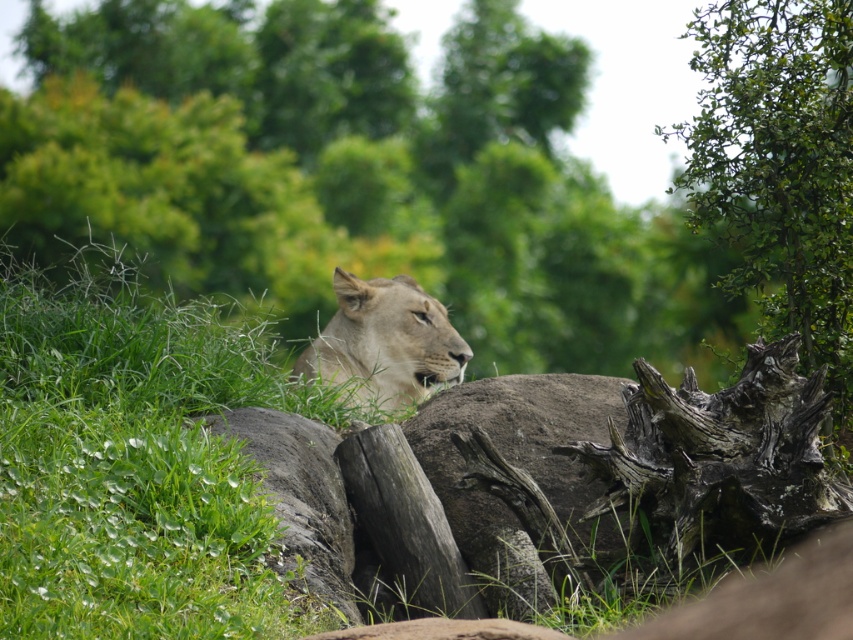
What is the location of the green leafy tree at right in the image?

The green leafy tree at right is located at point (780, 170).

You are a photographer trying to capture the light brown fur lion at center and the green leafy tree at right in the same frame. Which object would appear wider in the photo?

The light brown fur lion at center appears wider in the photo because the green leafy tree at right has a lesser width compared to it.

You are a photographer trying to capture the lioness in the scene. You notice a green leafy tree at right. Where is the point at coordinate (x=780, y=170) located in relation to the green leafy tree at right?

The point at coordinate (x=780, y=170) corresponds to the green leafy tree at right.